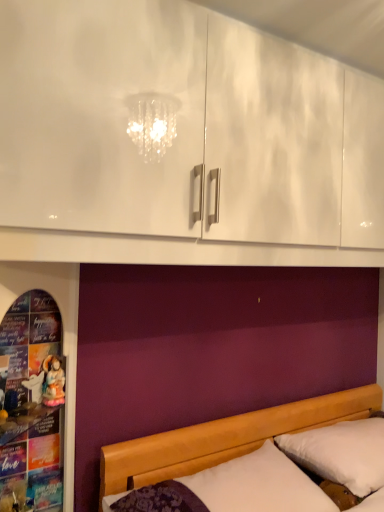
Question: Is white soft pillow at lower right at the left side of matte porcelain doll at left?

Choices:
 (A) yes
 (B) no

Answer: (B)

Question: From a real-world perspective, is white soft pillow at lower right physically below matte porcelain doll at left?

Choices:
 (A) no
 (B) yes

Answer: (B)

Question: Does white soft pillow at lower right have a lesser height compared to matte porcelain doll at left?

Choices:
 (A) no
 (B) yes

Answer: (A)

Question: Is there a large distance between white soft pillow at lower right and matte porcelain doll at left?

Choices:
 (A) yes
 (B) no

Answer: (A)

Question: From the image's perspective, is white soft pillow at lower right located above matte porcelain doll at left?

Choices:
 (A) yes
 (B) no

Answer: (B)

Question: From the image's perspective, would you say white soft pillow at lower right is shown under matte porcelain doll at left?

Choices:
 (A) yes
 (B) no

Answer: (A)

Question: Does wooden bed at lower right have a lesser width compared to white soft pillow at lower right?

Choices:
 (A) no
 (B) yes

Answer: (A)

Question: Considering the relative sizes of wooden bed at lower right and white soft pillow at lower right in the image provided, is wooden bed at lower right taller than white soft pillow at lower right?

Choices:
 (A) no
 (B) yes

Answer: (B)

Question: Is white soft pillow at lower right a part of wooden bed at lower right?

Choices:
 (A) no
 (B) yes

Answer: (A)

Question: Is wooden bed at lower right at the left side of white soft pillow at lower right?

Choices:
 (A) no
 (B) yes

Answer: (B)

Question: From the image's perspective, does wooden bed at lower right appear higher than white soft pillow at lower right?

Choices:
 (A) yes
 (B) no

Answer: (B)

Question: Can you confirm if wooden bed at lower right is bigger than white soft pillow at lower right?

Choices:
 (A) yes
 (B) no

Answer: (A)

Question: Is wooden bed at lower right wider than matte porcelain doll at left?

Choices:
 (A) no
 (B) yes

Answer: (B)